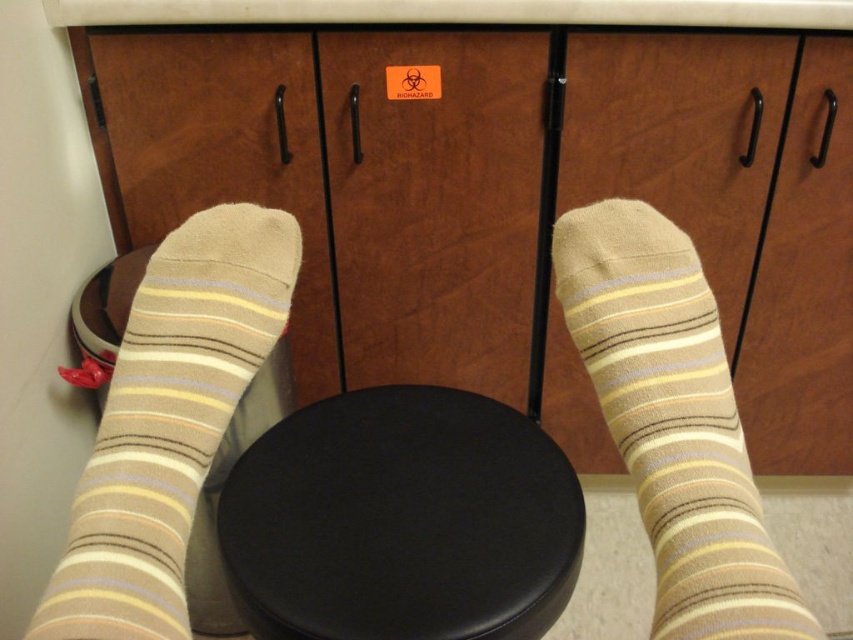
Can you confirm if tan striped sock at center is positioned to the right of tan striped sock at lower left?

Correct, you'll find tan striped sock at center to the right of tan striped sock at lower left.

Where is `tan striped sock at center`? tan striped sock at center is located at coordinates (672, 420).

Find the location of a particular element. This screenshot has height=640, width=853. tan striped sock at center is located at coordinates (672, 420).

Can you confirm if black leather stool at center is positioned to the right of tan striped sock at center?

Incorrect, black leather stool at center is not on the right side of tan striped sock at center.

Who is positioned more to the left, black leather stool at center or tan striped sock at center?

Positioned to the left is black leather stool at center.

Where is `black leather stool at center`? This screenshot has height=640, width=853. black leather stool at center is located at coordinates [x=402, y=520].

The width and height of the screenshot is (853, 640). Find the location of `black leather stool at center`. black leather stool at center is located at coordinates (402, 520).

Where is `black leather stool at center`? The image size is (853, 640). black leather stool at center is located at coordinates (402, 520).

Who is higher up, black leather stool at center or tan striped sock at lower left?

tan striped sock at lower left

Who is more distant from viewer, [318,406] or [218,294]?

The point [318,406] is behind.

The image size is (853, 640). What are the coordinates of `black leather stool at center` in the screenshot? It's located at (402, 520).